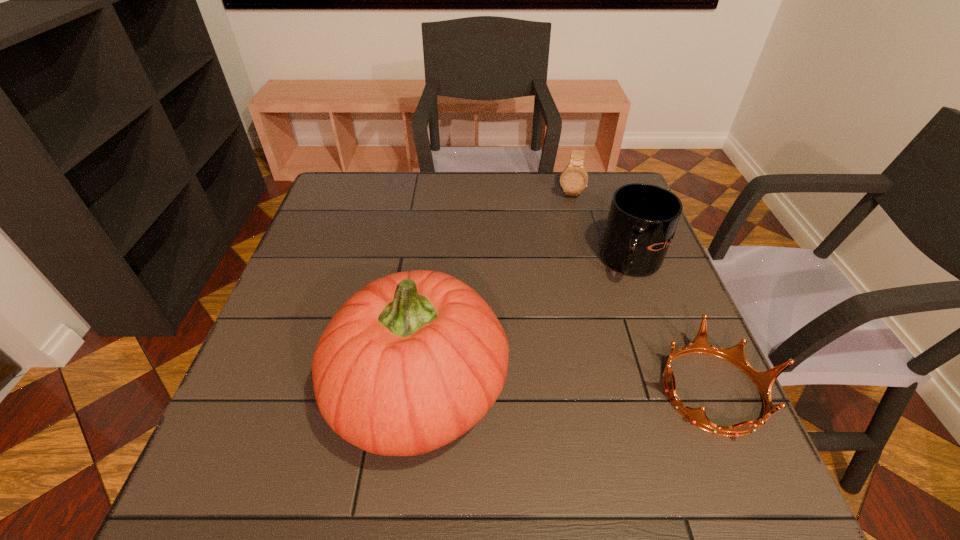
Identify the location of the tallest object. (412, 361).

Where is `pumpkin`? pumpkin is located at coordinates (412, 361).

Find the location of a particular element. The image size is (960, 540). the shortest object is located at coordinates (764, 381).

The height and width of the screenshot is (540, 960). I want to click on the third nearest object, so tap(641, 224).

This screenshot has height=540, width=960. In order to click on mug in this screenshot , I will do `click(641, 224)`.

Locate an element on the screen. This screenshot has width=960, height=540. the farthest object is located at coordinates (574, 178).

This screenshot has width=960, height=540. I want to click on the third tallest object, so click(574, 178).

Where is `free location located 0.110m on the right of the pumpkin`? This screenshot has height=540, width=960. free location located 0.110m on the right of the pumpkin is located at coordinates coord(564,390).

The image size is (960, 540). In order to click on vacant space located on the left of the shortest object in this screenshot , I will do `click(475, 391)`.

You are a GUI agent. You are given a task and a screenshot of the screen. Output one action in this format:
    pyautogui.click(x=<x>, y=<y>)
    Task: Click on the free space located 0.380m with the handle on the side of the mug
    This screenshot has width=960, height=540.
    Given the screenshot: What is the action you would take?
    pyautogui.click(x=528, y=392)